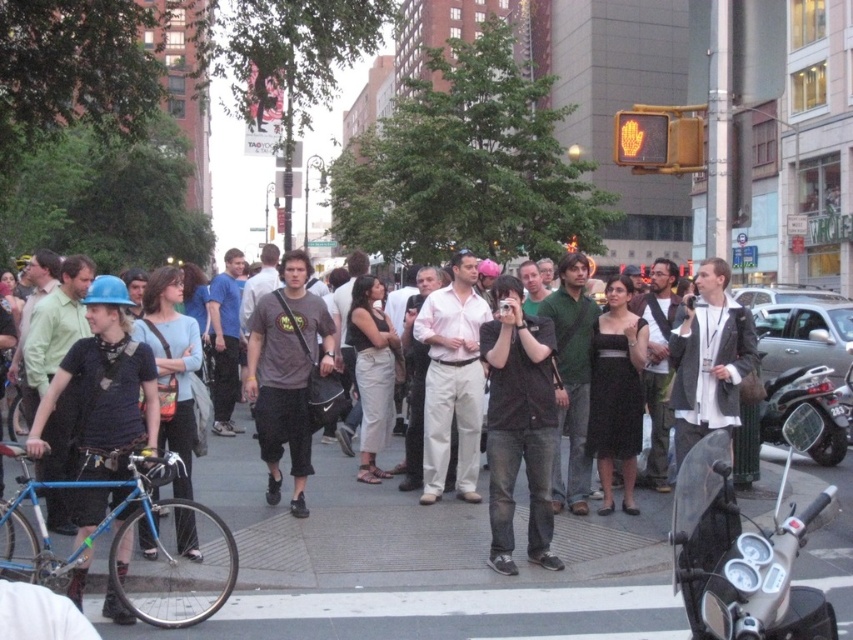
You are a delivery drone flying above the urban street scene. You need to drop a package at point A and then proceed to point B. Given that point A is point (798,536) and point B is point (305,344), which point should you visit first to ensure you can see both points clearly during your descent?

→ You should visit point A first because it is closer to the viewer than point B. Since point A is nearer, you can descend to it first, then move to the farther point B while maintaining visibility.